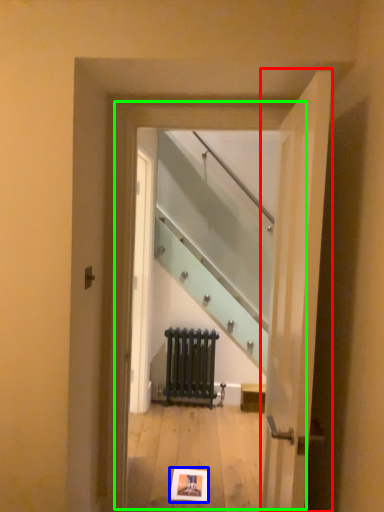
Question: Which is nearer to the door (highlighted by a red box)? postcard (highlighted by a blue box) or glass door (highlighted by a green box).

Choices:
 (A) postcard
 (B) glass door

Answer: (B)